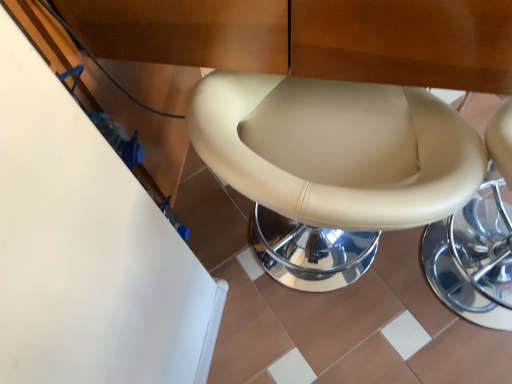
Where is `beige leather bar stool at center`? The image size is (512, 384). beige leather bar stool at center is located at coordinates (477, 242).

The width and height of the screenshot is (512, 384). What do you see at coordinates (477, 242) in the screenshot? I see `beige leather bar stool at center` at bounding box center [477, 242].

Find the location of `beige leather toilet at center`. beige leather toilet at center is located at coordinates (337, 149).

What do you see at coordinates (337, 149) in the screenshot? I see `beige leather toilet at center` at bounding box center [337, 149].

This screenshot has height=384, width=512. In order to click on beige leather bar stool at center in this screenshot , I will do `click(477, 242)`.

Between beige leather toilet at center and beige leather bar stool at center, which one appears on the left side from the viewer's perspective?

beige leather toilet at center.

Considering the positions of objects beige leather toilet at center and beige leather bar stool at center in the image provided, who is behind, beige leather toilet at center or beige leather bar stool at center?

beige leather bar stool at center is behind.

Which is nearer, (298,150) or (494,218)?

Point (298,150) appears to be closer to the viewer than point (494,218).

From the image's perspective, is beige leather toilet at center below beige leather bar stool at center?

No, from the image's perspective, beige leather toilet at center is not below beige leather bar stool at center.

From a real-world perspective, is beige leather toilet at center physically located above or below beige leather bar stool at center?

From a real-world perspective, beige leather toilet at center is physically above beige leather bar stool at center.

Which object is wider, beige leather toilet at center or beige leather bar stool at center?

beige leather toilet at center is wider.

Does beige leather toilet at center have a lesser height compared to beige leather bar stool at center?

Incorrect, the height of beige leather toilet at center does not fall short of that of beige leather bar stool at center.

Based on their sizes in the image, would you say beige leather toilet at center is bigger or smaller than beige leather bar stool at center?

Clearly, beige leather toilet at center is larger in size than beige leather bar stool at center.

Looking at this image, would you say beige leather toilet at center is inside or outside beige leather bar stool at center?

beige leather toilet at center is not enclosed by beige leather bar stool at center.

Does beige leather toilet at center touch beige leather bar stool at center?

beige leather toilet at center and beige leather bar stool at center are clearly separated.

Is beige leather toilet at center looking in the opposite direction of beige leather bar stool at center?

No, beige leather toilet at center is not facing away from beige leather bar stool at center.

From the picture: What's the angular difference between beige leather toilet at center and beige leather bar stool at center's facing directions?

They differ by 9.73e-06 degrees in their facing directions.

You are a GUI agent. You are given a task and a screenshot of the screen. Output one action in this format:
    pyautogui.click(x=<x>, y=<y>)
    Task: Click on the bar stool below the beige leather toilet at center (from a real-world perspective)
    The height and width of the screenshot is (384, 512).
    Given the screenshot: What is the action you would take?
    pyautogui.click(x=477, y=242)

Considering the relative positions of beige leather bar stool at center and beige leather toilet at center in the image provided, is beige leather bar stool at center to the left of beige leather toilet at center from the viewer's perspective?

In fact, beige leather bar stool at center is to the right of beige leather toilet at center.

Does beige leather bar stool at center lie behind beige leather toilet at center?

Yes, beige leather bar stool at center is further from the camera.

Does point (473, 308) come farther from viewer compared to point (313, 108)?

That is True.

From the image's perspective, which one is positioned lower, beige leather bar stool at center or beige leather toilet at center?

beige leather bar stool at center appears lower in the image.

From a real-world perspective, who is located lower, beige leather bar stool at center or beige leather toilet at center?

In real-world perspective, beige leather bar stool at center is lower.

Is beige leather bar stool at center thinner than beige leather toilet at center?

Yes, beige leather bar stool at center is thinner than beige leather toilet at center.

Between beige leather bar stool at center and beige leather toilet at center, which one has less height?

With less height is beige leather bar stool at center.

Is beige leather bar stool at center bigger than beige leather toilet at center?

No.

Is beige leather toilet at center a part of beige leather bar stool at center?

No.

Is beige leather bar stool at center positioned far away from beige leather toilet at center?

No.

Is beige leather toilet at center at the back of beige leather bar stool at center?

No, beige leather toilet at center is not at the back of beige leather bar stool at center.

Image resolution: width=512 pixels, height=384 pixels. In order to click on bar stool below the beige leather toilet at center (from the image's perspective) in this screenshot , I will do `click(477, 242)`.

Locate an element on the screen. bar stool located below the beige leather toilet at center (from the image's perspective) is located at coordinates (477, 242).

Where is `bar stool below the beige leather toilet at center (from a real-world perspective)`? The width and height of the screenshot is (512, 384). bar stool below the beige leather toilet at center (from a real-world perspective) is located at coordinates (477, 242).